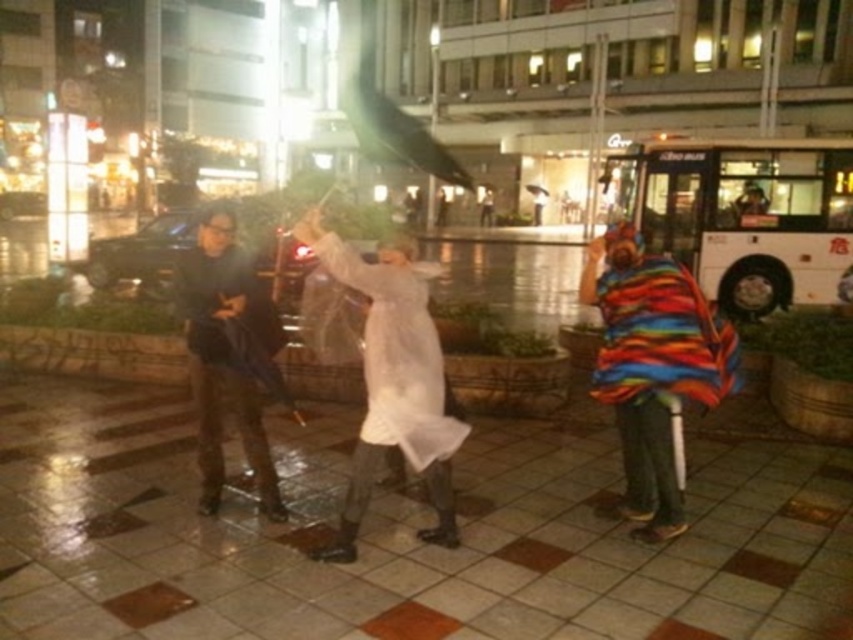
In the scene shown: Can you confirm if white translucent coat at center is positioned below dark blue fabric jacket at center?

Yes.

This screenshot has width=853, height=640. What are the coordinates of `white translucent coat at center` in the screenshot? It's located at (393, 380).